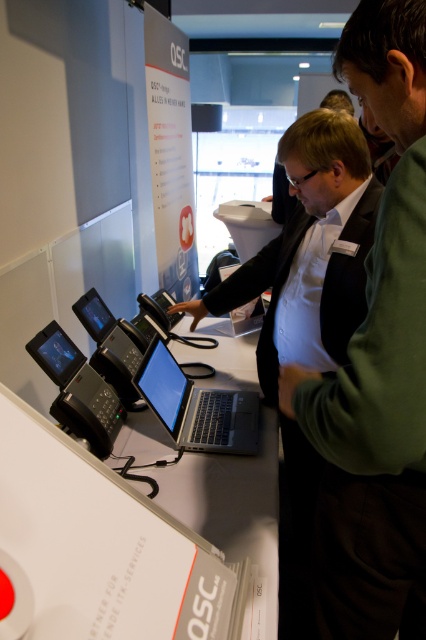
Does green fabric shirt at center have a greater width compared to satin black laptop at center?

Incorrect, green fabric shirt at center's width does not surpass satin black laptop at center's.

Is green fabric shirt at center further to camera compared to satin black laptop at center?

No, it is in front of satin black laptop at center.

Who is more forward, (x=377, y=342) or (x=187, y=384)?

Positioned in front is point (x=377, y=342).

Locate an element on the screen. green fabric shirt at center is located at coordinates 377,364.